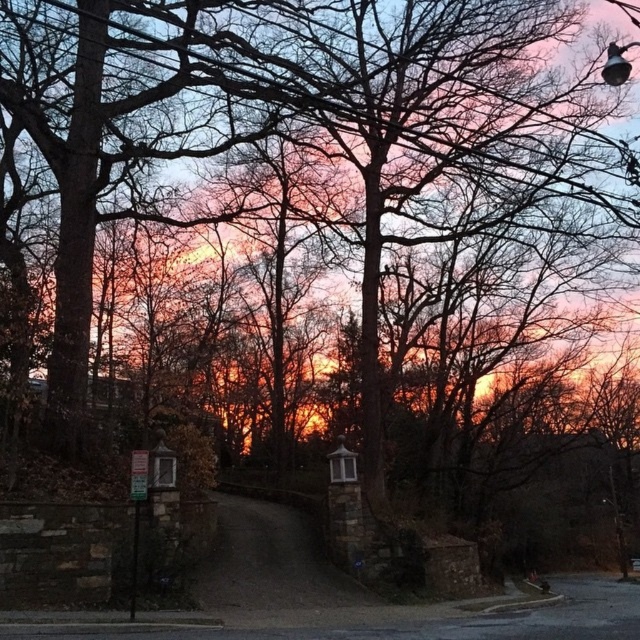
The height and width of the screenshot is (640, 640). I want to click on green plastic sign at lower left, so click(138, 474).

Can you confirm if green plastic sign at lower left is positioned below metallic pole at center?

Incorrect, green plastic sign at lower left is not positioned below metallic pole at center.

Is point (141, 490) less distant than point (131, 618)?

No, (141, 490) is behind (131, 618).

Locate an element on the screen. green plastic sign at lower left is located at coordinates (138, 474).